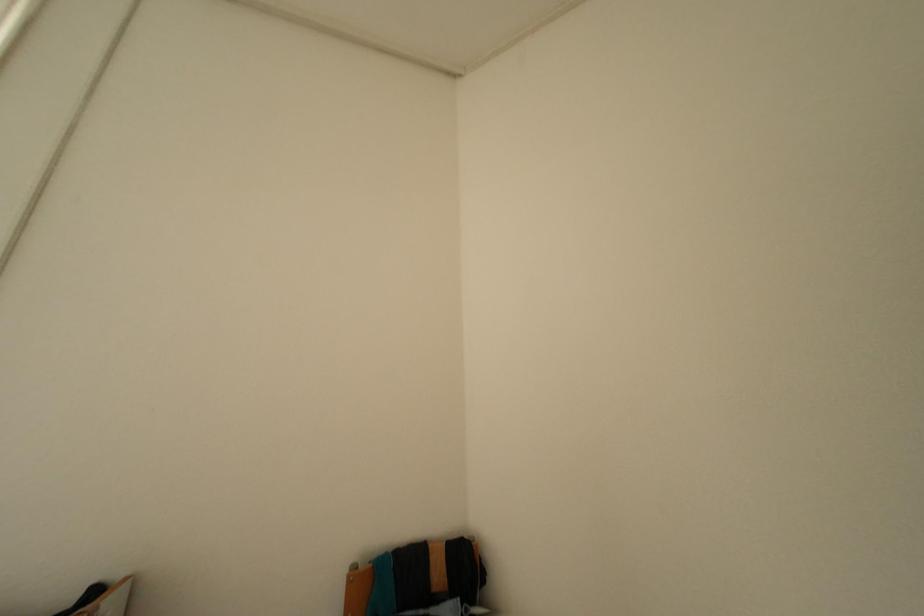
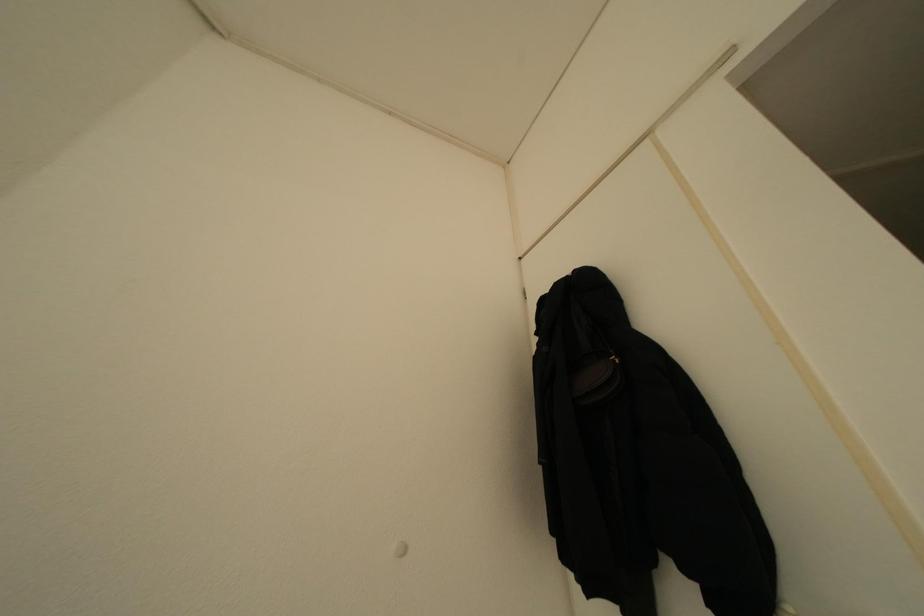
The first image is from the beginning of the video and the second image is from the end. How did the camera likely rotate when shooting the video?

The rotation direction of the camera is right-up.